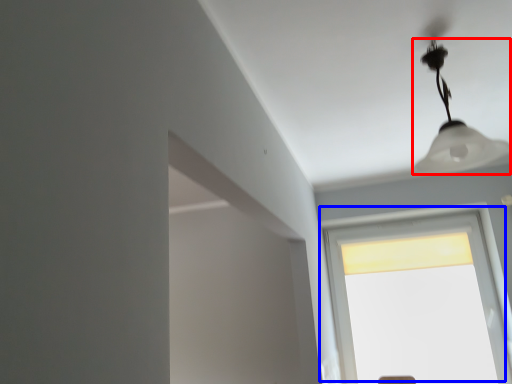
Question: Which of the following is the farthest to the observer, lamp (highlighted by a red box) or window (highlighted by a blue box)?

Choices:
 (A) lamp
 (B) window

Answer: (B)